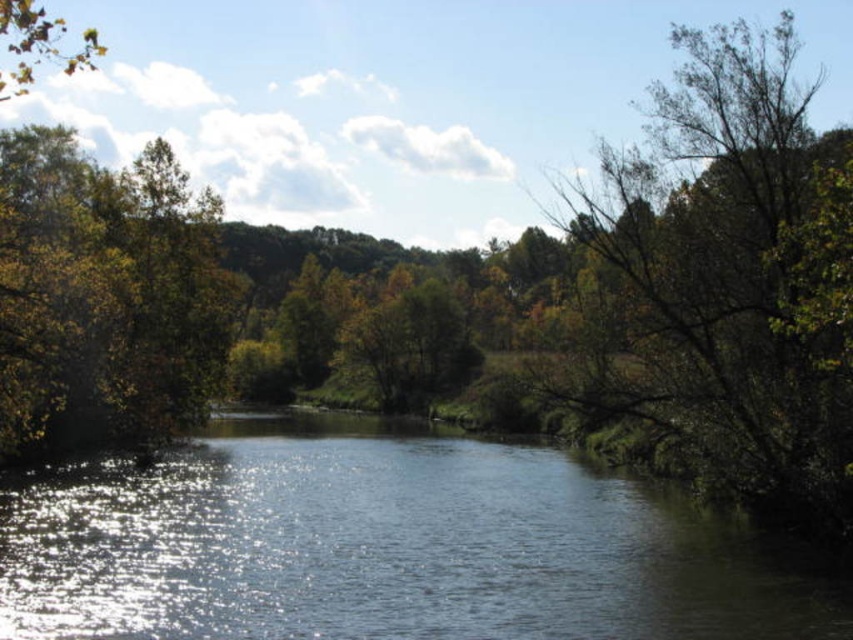
Question: Is clear water at center thinner than green leafy tree at right?

Choices:
 (A) yes
 (B) no

Answer: (A)

Question: Does clear water at center have a greater width compared to green leafy tree at right?

Choices:
 (A) no
 (B) yes

Answer: (A)

Question: Which object is farther from the camera taking this photo?

Choices:
 (A) green leafy tree at right
 (B) clear water at center

Answer: (B)

Question: Does clear water at center appear under green leafy tree at right?

Choices:
 (A) no
 (B) yes

Answer: (B)